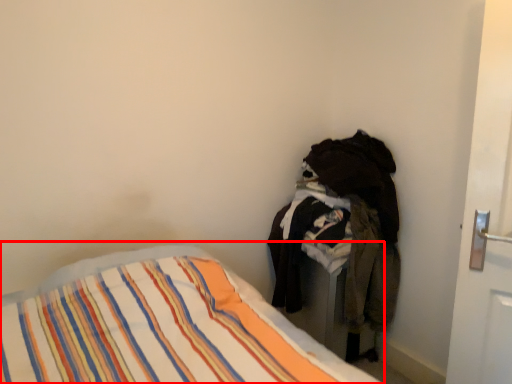
Question: From the image, what is the correct spatial relationship of bed (annotated by the red box) in relation to laundry?

Choices:
 (A) left
 (B) right

Answer: (A)